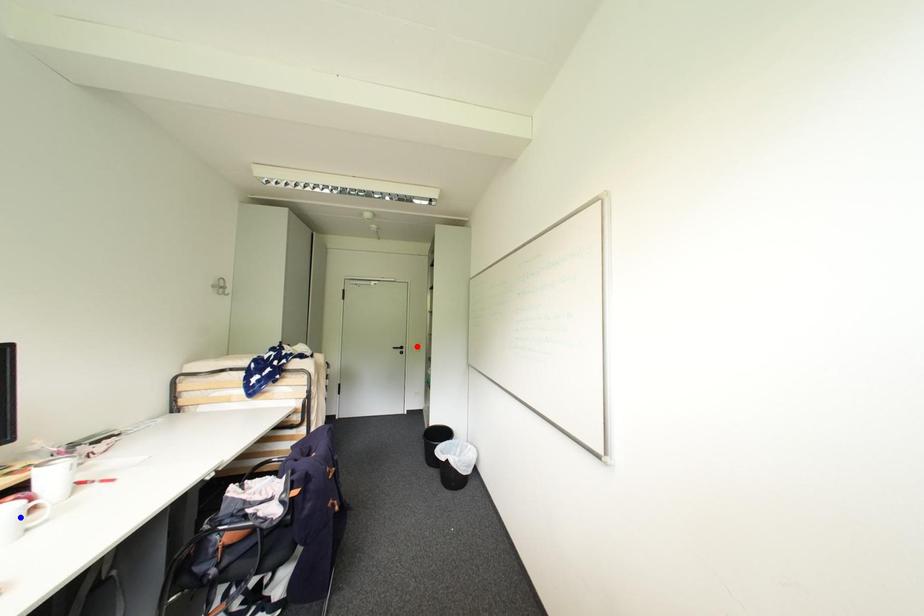
Question: Which of the two points in the image is closer to the camera?

Choices:
 (A) Blue point is closer.
 (B) Red point is closer.

Answer: (A)